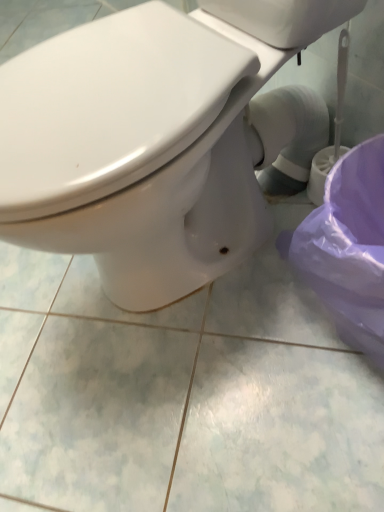
Question: Considering the relative sizes of white glossy toilet at center and purple plastic potty at lower right in the image provided, is white glossy toilet at center bigger than purple plastic potty at lower right?

Choices:
 (A) yes
 (B) no

Answer: (A)

Question: Is white glossy toilet at center oriented towards purple plastic potty at lower right?

Choices:
 (A) no
 (B) yes

Answer: (A)

Question: Does white glossy toilet at center have a smaller size compared to purple plastic potty at lower right?

Choices:
 (A) yes
 (B) no

Answer: (B)

Question: From a real-world perspective, is white glossy toilet at center below purple plastic potty at lower right?

Choices:
 (A) no
 (B) yes

Answer: (A)

Question: Is white glossy toilet at center in front of purple plastic potty at lower right?

Choices:
 (A) yes
 (B) no

Answer: (A)

Question: Is white glossy toilet at center completely or partially outside of purple plastic potty at lower right?

Choices:
 (A) no
 (B) yes

Answer: (B)

Question: Is the position of purple plastic potty at lower right more distant than that of white glossy toilet at center?

Choices:
 (A) no
 (B) yes

Answer: (B)

Question: Considering the relative sizes of purple plastic potty at lower right and white glossy toilet at center in the image provided, is purple plastic potty at lower right taller than white glossy toilet at center?

Choices:
 (A) no
 (B) yes

Answer: (A)

Question: Is purple plastic potty at lower right shorter than white glossy toilet at center?

Choices:
 (A) yes
 (B) no

Answer: (A)

Question: Is the depth of purple plastic potty at lower right less than that of white glossy toilet at center?

Choices:
 (A) no
 (B) yes

Answer: (A)

Question: From the image's perspective, does purple plastic potty at lower right appear lower than white glossy toilet at center?

Choices:
 (A) no
 (B) yes

Answer: (B)

Question: Considering the relative sizes of purple plastic potty at lower right and white glossy toilet at center in the image provided, is purple plastic potty at lower right smaller than white glossy toilet at center?

Choices:
 (A) yes
 (B) no

Answer: (A)

Question: From the image's perspective, is purple plastic potty at lower right located above or below white glossy toilet at center?

Choices:
 (A) below
 (B) above

Answer: (A)